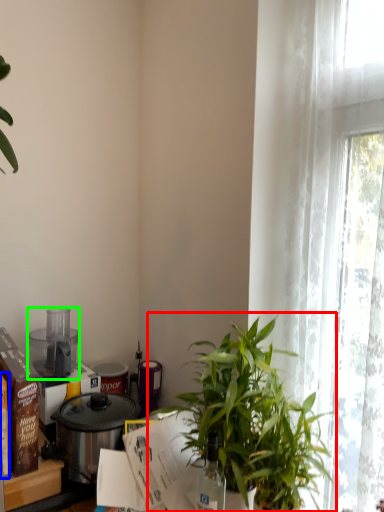
Question: Estimate the real-world distances between objects in this image. Which object is farther from houseplant (highlighted by a red box), box (highlighted by a blue box) or kitchen appliance (highlighted by a green box)?

Choices:
 (A) box
 (B) kitchen appliance

Answer: (B)